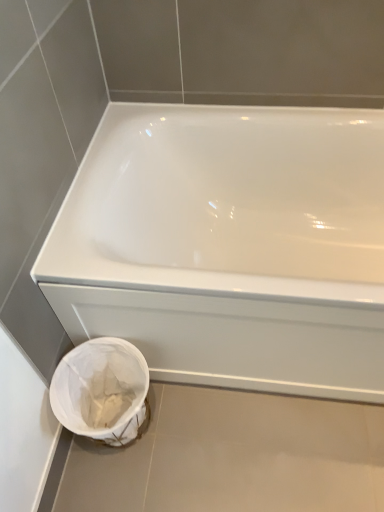
Question: Looking at their shapes, would you say white glossy bathtub at center is wider or thinner than white fabric bag at lower left?

Choices:
 (A) thin
 (B) wide

Answer: (B)

Question: Does point (261, 256) appear closer or farther from the camera than point (129, 347)?

Choices:
 (A) farther
 (B) closer

Answer: (A)

Question: From a real-world perspective, is white glossy bathtub at center positioned above or below white fabric bag at lower left?

Choices:
 (A) below
 (B) above

Answer: (B)

Question: Considering the positions of white fabric bag at lower left and white glossy bathtub at center in the image, is white fabric bag at lower left taller or shorter than white glossy bathtub at center?

Choices:
 (A) tall
 (B) short

Answer: (B)

Question: Which is correct: white fabric bag at lower left is inside white glossy bathtub at center, or outside of it?

Choices:
 (A) inside
 (B) outside

Answer: (B)

Question: From the image's perspective, is white fabric bag at lower left positioned above or below white glossy bathtub at center?

Choices:
 (A) below
 (B) above

Answer: (A)

Question: Is white fabric bag at lower left wider or thinner than white glossy bathtub at center?

Choices:
 (A) wide
 (B) thin

Answer: (B)